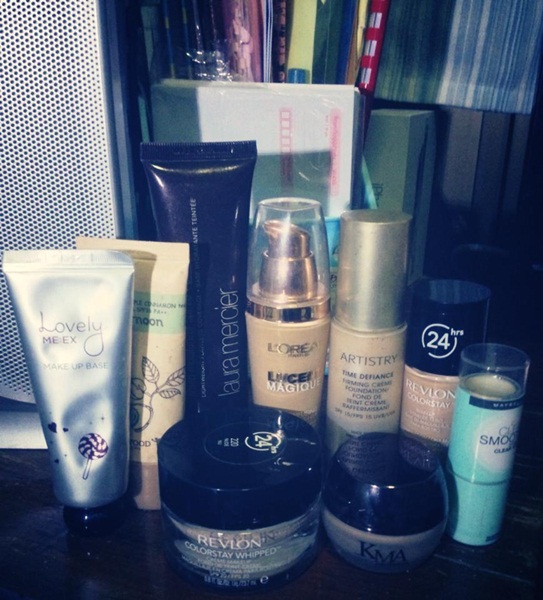
Locate an element on the screen. The image size is (543, 600). box is located at coordinates (366, 157).